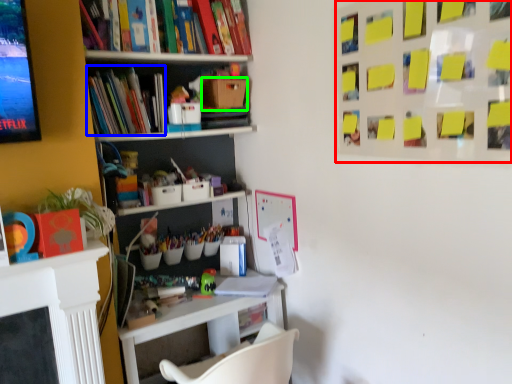
Question: Which object is positioned closest to bulletin board (highlighted by a red box)? Select from book (highlighted by a blue box) and cardboard box (highlighted by a green box).

Choices:
 (A) book
 (B) cardboard box

Answer: (B)